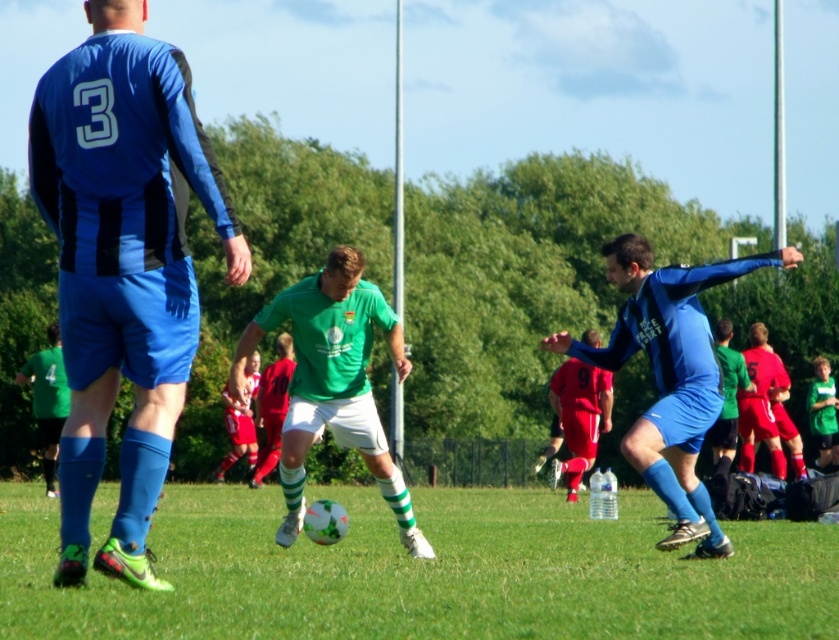
Who is lower down, green matte jersey at lower left or green jersey at center?

green matte jersey at lower left is below.

Where is `green matte jersey at lower left`? The image size is (839, 640). green matte jersey at lower left is located at coordinates (48, 400).

Is matte blue jersey at center above blue matte jersey at center?

Correct, matte blue jersey at center is located above blue matte jersey at center.

At what (x,y) coordinates should I click in order to perform the action: click on matte blue jersey at center. Please return your answer as a coordinate pair (x, y). The image size is (839, 640). Looking at the image, I should click on (123, 262).

Image resolution: width=839 pixels, height=640 pixels. I want to click on matte blue jersey at center, so click(123, 262).

Find the location of `green matte jersey at center`. green matte jersey at center is located at coordinates pyautogui.click(x=332, y=381).

Does green matte jersey at center have a greater width compared to green matte jersey at lower left?

Yes.

Is point (386, 307) farther from camera compared to point (53, 412)?

No, (386, 307) is in front of (53, 412).

This screenshot has height=640, width=839. In order to click on green matte jersey at center in this screenshot , I will do `click(332, 381)`.